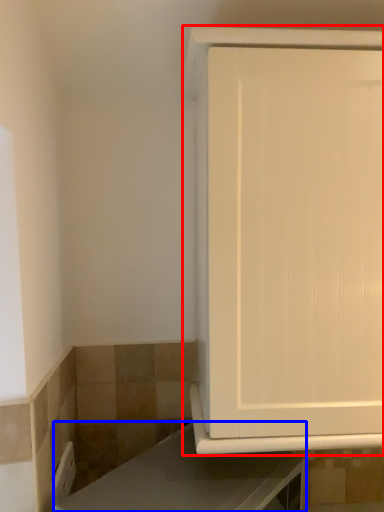
Question: Which point is further to the camera, cabinetry (highlighted by a red box) or countertop (highlighted by a blue box)?

Choices:
 (A) cabinetry
 (B) countertop

Answer: (A)